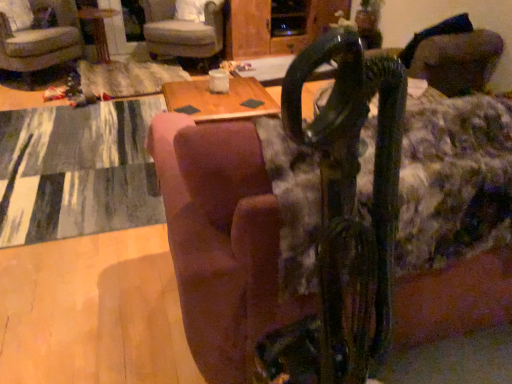
Question: Can you confirm if wooden table at center is smaller than brown fabric couch at center?

Choices:
 (A) yes
 (B) no

Answer: (A)

Question: Is wooden table at center beside brown fabric couch at center?

Choices:
 (A) no
 (B) yes

Answer: (A)

Question: Can you confirm if wooden table at center is positioned to the left of brown fabric couch at center?

Choices:
 (A) yes
 (B) no

Answer: (A)

Question: Is wooden table at center to the right of brown fabric couch at center from the viewer's perspective?

Choices:
 (A) yes
 (B) no

Answer: (B)

Question: Is wooden table at center far away from brown fabric couch at center?

Choices:
 (A) no
 (B) yes

Answer: (B)

Question: From the image's perspective, is wooden table at center beneath brown fabric couch at center?

Choices:
 (A) no
 (B) yes

Answer: (A)

Question: From the image's perspective, is velvet-like gray armchair at upper center, which is the first chair in right-to-left order, on brown fabric couch at center?

Choices:
 (A) yes
 (B) no

Answer: (A)

Question: Is the position of velvet-like gray armchair at upper center, arranged as the second chair when viewed from the left, more distant than that of brown fabric couch at center?

Choices:
 (A) yes
 (B) no

Answer: (A)

Question: Is velvet-like gray armchair at upper center, which is the first chair in right-to-left order, to the left of brown fabric couch at center from the viewer's perspective?

Choices:
 (A) yes
 (B) no

Answer: (A)

Question: Is velvet-like gray armchair at upper center, which is the first chair in right-to-left order, completely or partially outside of brown fabric couch at center?

Choices:
 (A) no
 (B) yes

Answer: (B)

Question: Does velvet-like gray armchair at upper center, arranged as the second chair when viewed from the left, lie in front of brown fabric couch at center?

Choices:
 (A) yes
 (B) no

Answer: (B)

Question: From a real-world perspective, is velvet-like gray armchair at upper center, arranged as the second chair when viewed from the left, positioned over brown fabric couch at center based on gravity?

Choices:
 (A) yes
 (B) no

Answer: (B)

Question: From the image's perspective, is brown fabric couch at center located above textured gray rug at lower left?

Choices:
 (A) yes
 (B) no

Answer: (B)